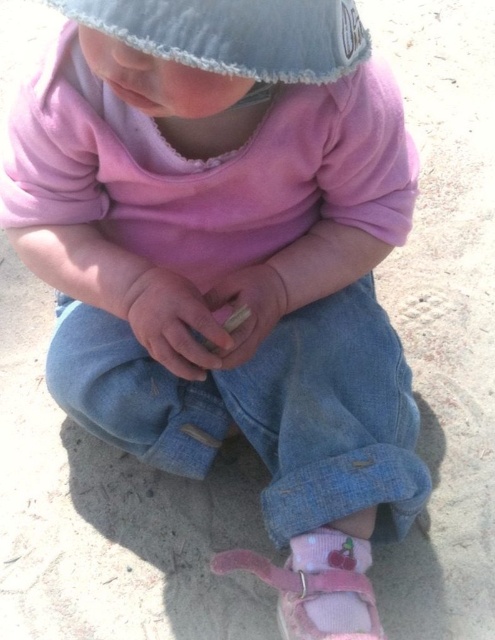
You are a photographer setting up a tripod at position point 0.055, 0.479. You notice the denim knit hat at upper center in the scene. Is the hat positioned exactly where you want to place the tripod?

The denim knit hat at upper center is located at point (237, 35), so yes, the hat is exactly where you want to place the tripod.

You are a drone operator trying to locate two points in a photo of a child playing on a sandy area. The points are labeled as point (164,289) and point (208,300). From the child perspective, which point is closer to the front?

Point (164,289) is in front of point (208,300), so from the child perspective, point (164,289) is closer to the front.

You are a child who wants to pick up both the smooth beige stick at center and the wooden stick at center. Since you can only hold one stick at a time, which stick should you pick up first if you want to minimize the distance you have to walk between them?

You should pick up the smooth beige stick at center first because it is only 5.20 centimeters away from the wooden stick at center, so after picking up one, you can easily reach the other with minimal walking distance.